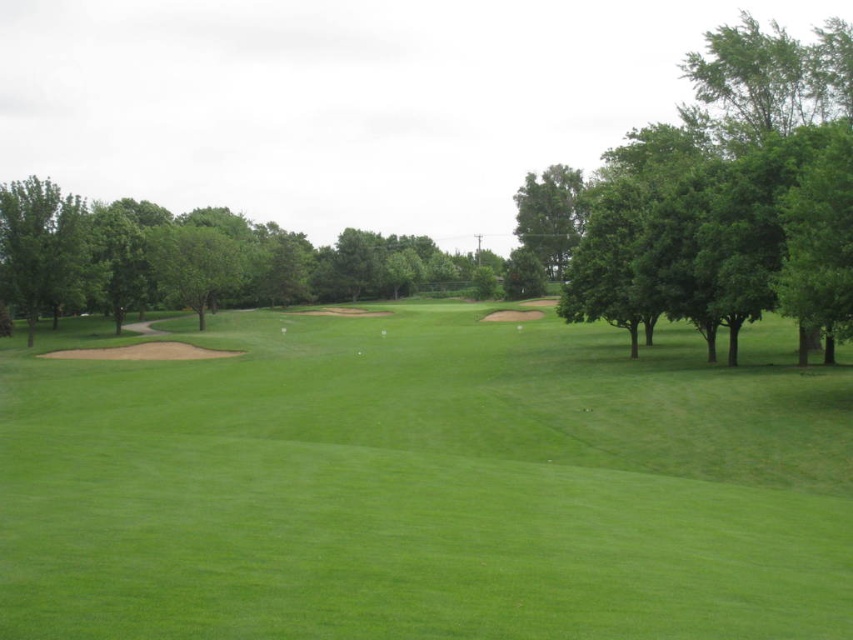
Question: Which point is closer to the camera?

Choices:
 (A) (659, 289)
 (B) (554, 188)
 (C) (241, 244)

Answer: (A)

Question: Among these points, which one is nearest to the camera?

Choices:
 (A) (567, 248)
 (B) (735, 35)

Answer: (B)

Question: Does green leafy tree at left appear on the right side of green leafy tree at upper center?

Choices:
 (A) no
 (B) yes

Answer: (A)

Question: Can you confirm if green grassy field at center is positioned to the left of green leafy tree at left?

Choices:
 (A) no
 (B) yes

Answer: (A)

Question: Is green leafy tree at left positioned in front of green leafy tree at upper center?

Choices:
 (A) no
 (B) yes

Answer: (B)

Question: Which of the following is the farthest from the observer?

Choices:
 (A) green leafy tree at right
 (B) green leafy tree at left
 (C) green grassy field at center
 (D) green leafy tree at upper center

Answer: (D)